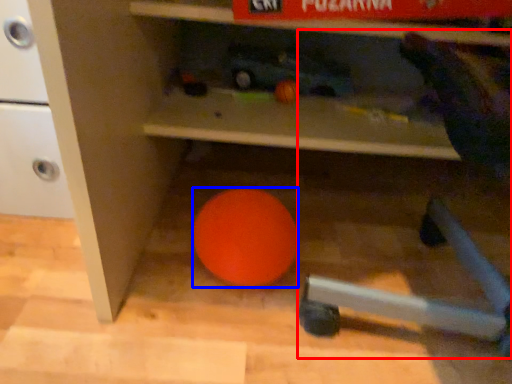
Question: Which point is closer to the camera, bean bag chair (highlighted by a red box) or ball (highlighted by a blue box)?

Choices:
 (A) bean bag chair
 (B) ball

Answer: (A)